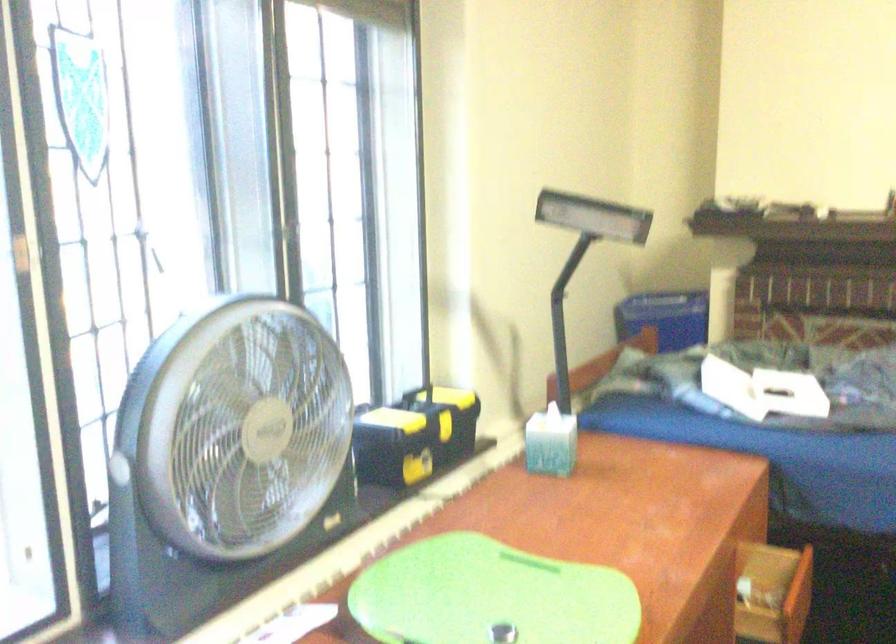
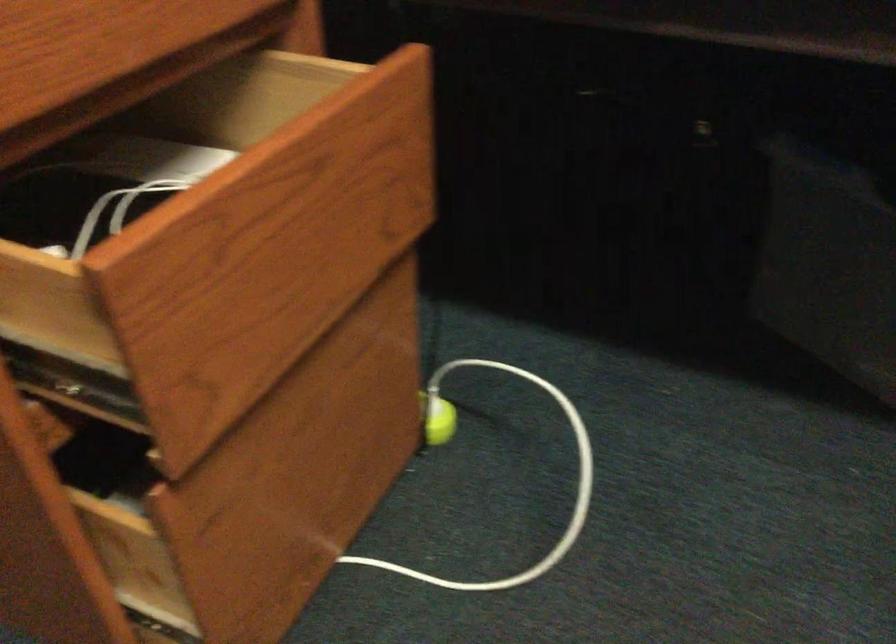
Where in the second image is the point corresponding to point (768, 551) from the first image?

(323, 62)